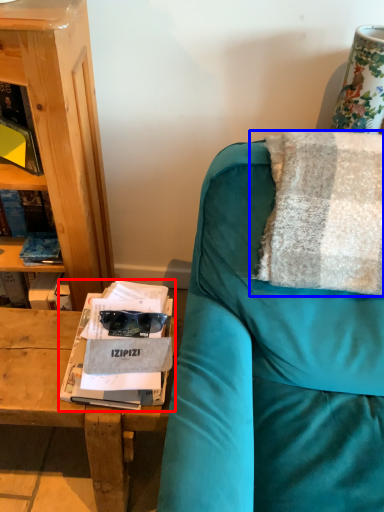
Question: Among these objects, which one is nearest to the camera, magazine (highlighted by a red box) or pillow (highlighted by a blue box)?

Choices:
 (A) magazine
 (B) pillow

Answer: (B)